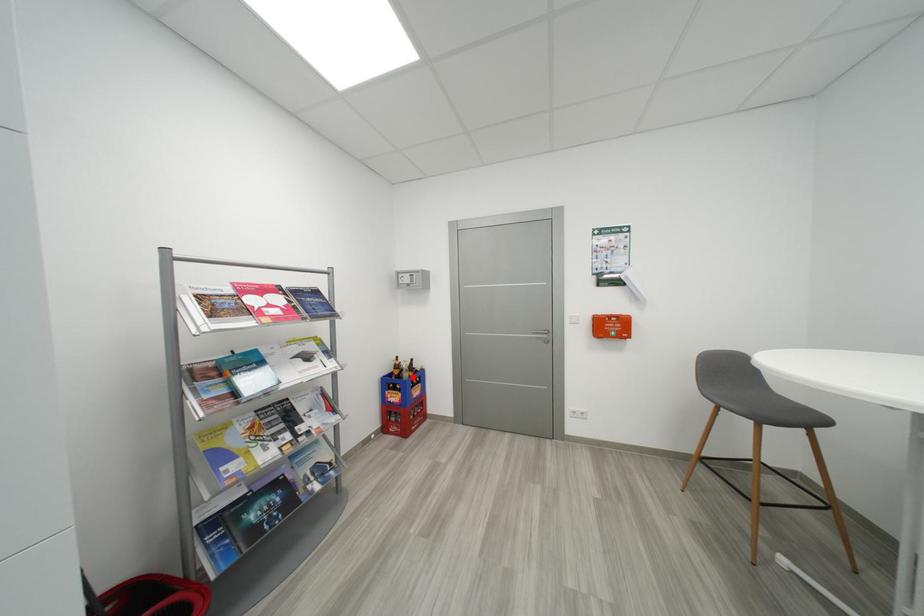
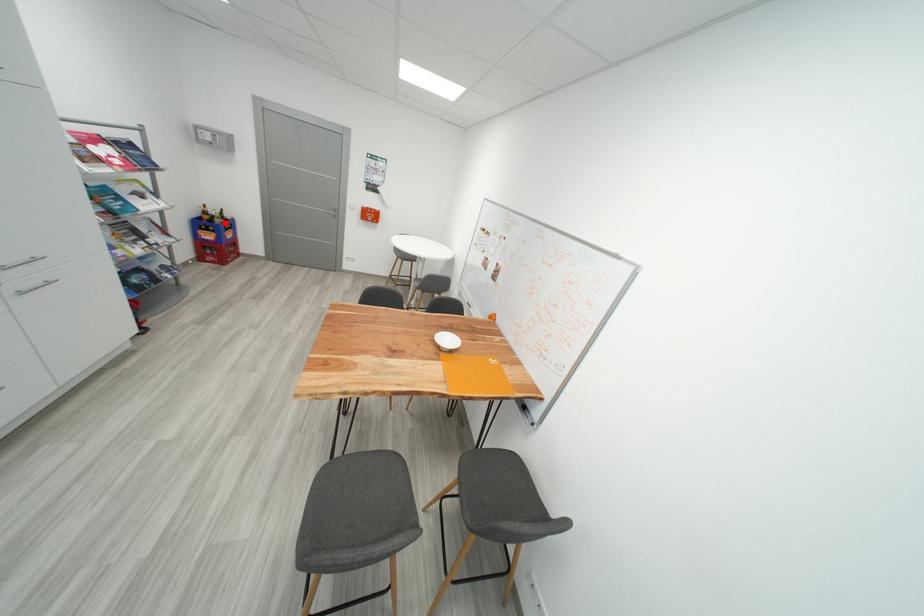
I am providing you with two images of the same scene from different viewpoints. A red point is marked on the first image and another point is marked on the second image. Do the highlighted points in image1 and image2 indicate the same real-world spot?

Yes